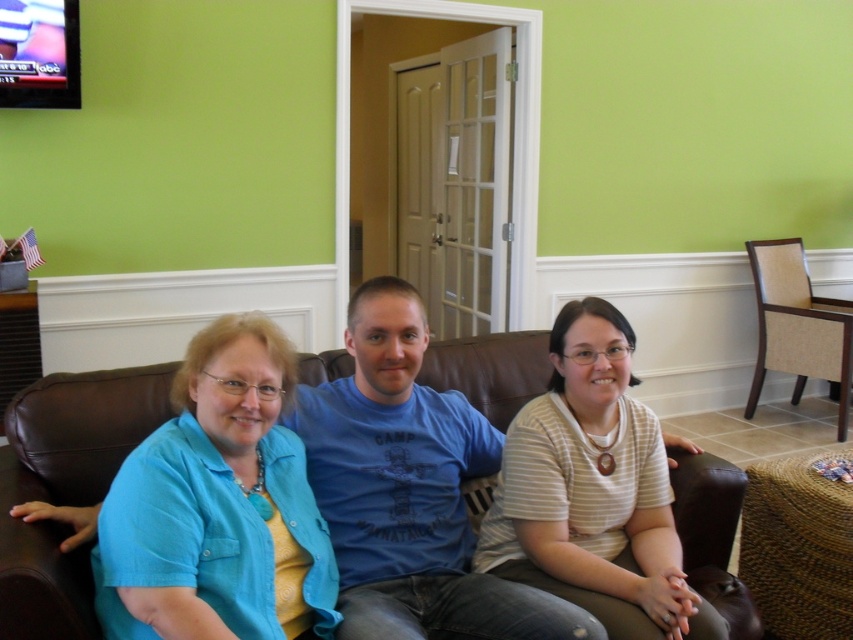
In the scene shown: Does blue cotton t-shirt at center have a larger size compared to brown fabric armchair at right?

No, blue cotton t-shirt at center is not bigger than brown fabric armchair at right.

Is point (350, 344) in front of point (808, 358)?

Yes, point (350, 344) is closer to viewer.

The height and width of the screenshot is (640, 853). Find the location of `blue cotton t-shirt at center`. blue cotton t-shirt at center is located at coordinates (409, 490).

Find the location of a particular element. blue cotton t-shirt at center is located at coordinates (409, 490).

Between blue cotton shirt at left and white striped shirt at center, which one appears on the left side from the viewer's perspective?

blue cotton shirt at left

Is blue cotton shirt at left below white striped shirt at center?

Actually, blue cotton shirt at left is above white striped shirt at center.

You are a GUI agent. You are given a task and a screenshot of the screen. Output one action in this format:
    pyautogui.click(x=<x>, y=<y>)
    Task: Click on the blue cotton shirt at left
    
    Given the screenshot: What is the action you would take?
    pyautogui.click(x=218, y=506)

Where is `blue cotton shirt at left`? The height and width of the screenshot is (640, 853). blue cotton shirt at left is located at coordinates 218,506.

From the picture: Measure the distance from blue cotton shirt at left to blue cotton t-shirt at center.

The distance of blue cotton shirt at left from blue cotton t-shirt at center is 9.92 inches.

Is point (202, 500) positioned in front of point (415, 317)?

That is True.

Who is more distant from viewer, (123,588) or (373,636)?

Positioned behind is point (373,636).

The height and width of the screenshot is (640, 853). I want to click on blue cotton shirt at left, so click(x=218, y=506).